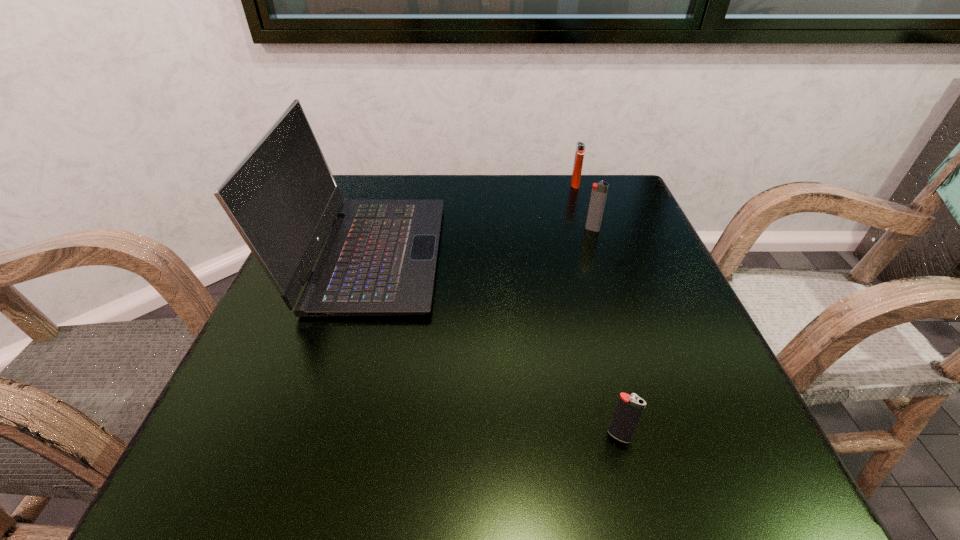
Image resolution: width=960 pixels, height=540 pixels. Find the location of `laptop computer`. laptop computer is located at coordinates (379, 259).

The height and width of the screenshot is (540, 960). Find the location of `the tallest object`. the tallest object is located at coordinates (379, 259).

Where is `the second nearest igniter`? The image size is (960, 540). the second nearest igniter is located at coordinates (599, 191).

Find the location of `the farthest object`. the farthest object is located at coordinates (580, 147).

Where is `the shortest object`? This screenshot has height=540, width=960. the shortest object is located at coordinates (629, 408).

The height and width of the screenshot is (540, 960). Find the location of `the nearest igniter`. the nearest igniter is located at coordinates (629, 408).

The image size is (960, 540). I want to click on vacant space situated 0.260m on the screen of the laptop computer, so click(564, 254).

This screenshot has height=540, width=960. What are the coordinates of `vacant area situated 0.220m on the back of the second nearest igniter` in the screenshot? It's located at (575, 178).

This screenshot has height=540, width=960. I want to click on free space located on the front of the farthest object, so click(591, 235).

What are the coordinates of `vacant point located on the back of the third object from right to left` in the screenshot? It's located at (575, 262).